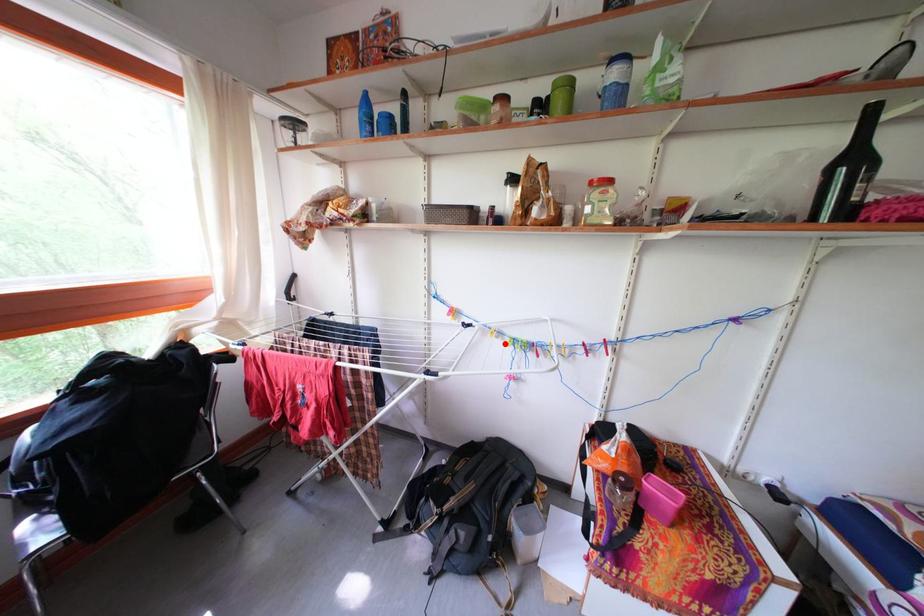
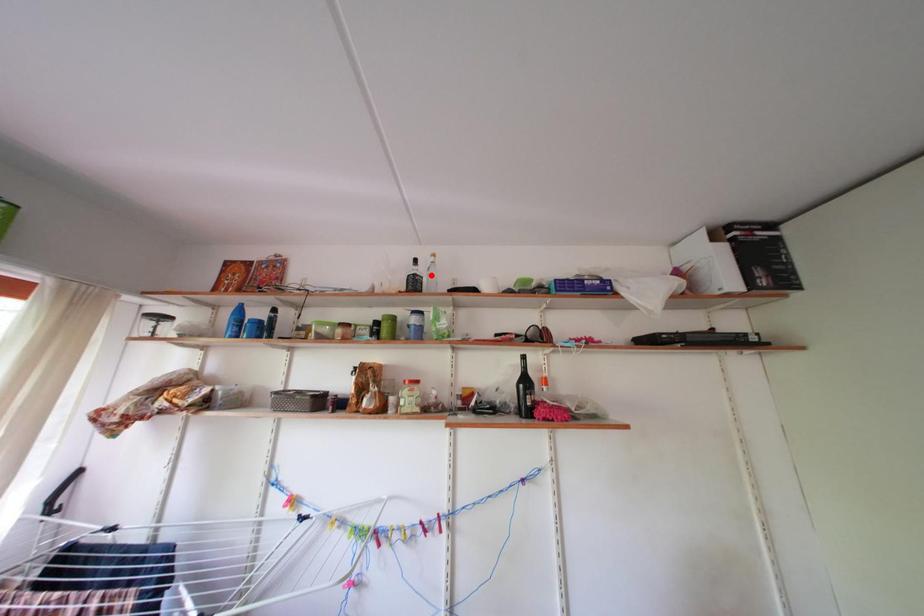
I am providing you with two images of the same scene from different viewpoints. A red point is marked on the first image and another point is marked on the second image. Do the highlighted points in image1 and image2 indicate the same real-world spot?

No